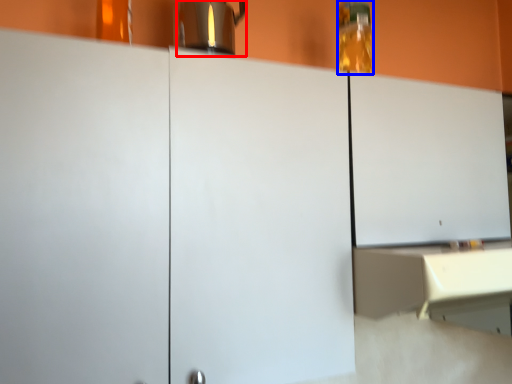
Question: Which of the following is the farthest to the observer, coffeepot (highlighted by a red box) or bottle (highlighted by a blue box)?

Choices:
 (A) coffeepot
 (B) bottle

Answer: (B)